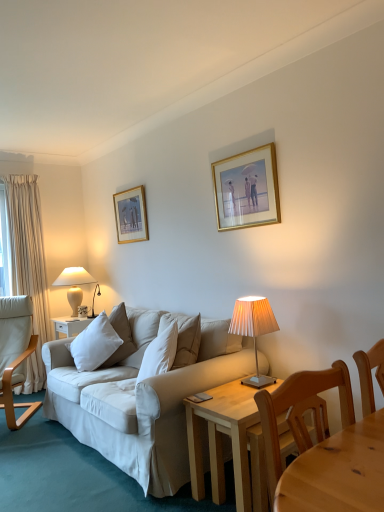
At what (x,y) coordinates should I click in order to perform the action: click on white ceramic lamp at left, the 2th lamp in the front-to-back sequence. Please return your answer as a coordinate pair (x, y). Looking at the image, I should click on tap(74, 285).

Where is `light wood table at lower right`? The height and width of the screenshot is (512, 384). light wood table at lower right is located at coordinates (221, 440).

Identify the location of white soft pillow at left. (95, 344).

The image size is (384, 512). Describe the element at coordinates (131, 215) in the screenshot. I see `gold-framed picture at upper center, placed as the 2th picture frame when sorted from front to back` at that location.

The width and height of the screenshot is (384, 512). Describe the element at coordinates (141, 402) in the screenshot. I see `white fabric couch at center` at that location.

Where is `white ceramic lamp at left, which ranks as the 1th lamp in left-to-right order`? The image size is (384, 512). white ceramic lamp at left, which ranks as the 1th lamp in left-to-right order is located at coordinates (74, 285).

From a real-world perspective, is light brown wooden chair at lower right, arranged as the second chair when viewed from the back, physically located above or below white fabric couch at center?

Clearly, from a real-world perspective, light brown wooden chair at lower right, arranged as the second chair when viewed from the back, is above white fabric couch at center.

Which of these two, light brown wooden chair at lower right, placed as the second chair when sorted from left to right, or white fabric couch at center, stands taller?

light brown wooden chair at lower right, placed as the second chair when sorted from left to right.

Is light brown wooden chair at lower right, arranged as the second chair when viewed from the back, positioned with its back to white fabric couch at center?

Yes, white fabric couch at center is at the back of light brown wooden chair at lower right, arranged as the second chair when viewed from the back.

From the picture: Considering the sizes of objects light brown wooden chair at lower right, arranged as the second chair when viewed from the back, and white fabric couch at center in the image provided, who is smaller, light brown wooden chair at lower right, arranged as the second chair when viewed from the back, or white fabric couch at center?

light brown wooden chair at lower right, arranged as the second chair when viewed from the back.

At what (x,y) coordinates should I click in order to perform the action: click on studio couch below the white soft pillow at left (from a real-world perspective). Please return your answer as a coordinate pair (x, y). This screenshot has height=512, width=384. Looking at the image, I should click on (141, 402).

Could you tell me if white soft pillow at left is turned towards white fabric couch at center?

No.

Can you confirm if white soft pillow at left is thinner than white fabric couch at center?

Indeed, white soft pillow at left has a lesser width compared to white fabric couch at center.

Which of these two, white soft pillow at left or white fabric couch at center, stands taller?

white soft pillow at left.

Can you confirm if light brown wood chair at left, which is the first chair in left-to-right order, is taller than gold-framed picture at upper center, which is counted as the first picture frame, starting from the left?

Indeed, light brown wood chair at left, which is the first chair in left-to-right order, has a greater height compared to gold-framed picture at upper center, which is counted as the first picture frame, starting from the left.

Is light brown wood chair at left, arranged as the 2th chair when viewed from the right, turned away from gold-framed picture at upper center, arranged as the 2th picture frame when viewed from the right?

No.

Does light brown wood chair at left, arranged as the 2th chair when viewed from the right, touch gold-framed picture at upper center, arranged as the 2th picture frame when viewed from the right?

No, light brown wood chair at left, arranged as the 2th chair when viewed from the right, is not in contact with gold-framed picture at upper center, arranged as the 2th picture frame when viewed from the right.

Which is farther from the camera, (1, 404) or (121, 211)?

Point (121, 211)

Is gold-framed picture at upper center, placed as the 2th picture frame when sorted from front to back, next to white soft pillow at left?

gold-framed picture at upper center, placed as the 2th picture frame when sorted from front to back, and white soft pillow at left are clearly separated.

Is gold-framed picture at upper center, arranged as the 2th picture frame when viewed from the right, looking in the opposite direction of white soft pillow at left?

No, gold-framed picture at upper center, arranged as the 2th picture frame when viewed from the right,'s orientation is not away from white soft pillow at left.

Does gold-framed picture at upper center, placed as the 2th picture frame when sorted from front to back, have a greater height compared to white soft pillow at left?

Yes.

Which is closer to the camera, (264, 298) or (217, 198)?

Clearly, point (264, 298) is closer to the camera than point (217, 198).

From the image's perspective, which object appears higher, pleated beige lampshade at center, which is the first lamp from right to left, or gold metallic picture frame at upper center, acting as the first picture frame starting from the front?

From the image's view, gold metallic picture frame at upper center, acting as the first picture frame starting from the front, is above.

From a real-world perspective, is pleated beige lampshade at center, which is the first lamp from right to left, over gold metallic picture frame at upper center, which is the first picture frame from right to left?

No, from a real-world perspective, pleated beige lampshade at center, which is the first lamp from right to left, is not over gold metallic picture frame at upper center, which is the first picture frame from right to left

From a real-world perspective, is white fabric couch at center above or below pleated beige lampshade at center, the 1th lamp positioned from the front?

Clearly, from a real-world perspective, white fabric couch at center is below pleated beige lampshade at center, the 1th lamp positioned from the front.

Who is shorter, white fabric couch at center or pleated beige lampshade at center, the 1th lamp positioned from the front?

With less height is white fabric couch at center.

Is white fabric couch at center inside or outside of pleated beige lampshade at center, positioned as the second lamp in left-to-right order?

white fabric couch at center is outside pleated beige lampshade at center, positioned as the second lamp in left-to-right order.

Measure the distance between white ceramic lamp at left, which ranks as the 1th lamp in left-to-right order, and white soft pillow at left.

white ceramic lamp at left, which ranks as the 1th lamp in left-to-right order, and white soft pillow at left are 3.47 feet apart from each other.

From a real-world perspective, is white ceramic lamp at left, which ranks as the 1th lamp in left-to-right order, on top of white soft pillow at left?

Yes.

Between white ceramic lamp at left, the second lamp in the right-to-left sequence, and white soft pillow at left, which one appears on the right side from the viewer's perspective?

Positioned to the right is white soft pillow at left.

Which is farther from the camera, (81, 281) or (72, 355)?

The point (81, 281) is more distant.

Locate an element on the screen. studio couch on the left of the light brown wooden chair at lower right, the 1th chair from the front is located at coordinates (141, 402).

Where is `studio couch below the white soft pillow at left (from a real-world perspective)`? The height and width of the screenshot is (512, 384). studio couch below the white soft pillow at left (from a real-world perspective) is located at coordinates (141, 402).

Looking at the image, which one is located closer to light brown wooden chair at lower right, arranged as the second chair when viewed from the back, light wood table at lower right or gold metallic picture frame at upper center, acting as the first picture frame starting from the front?

light wood table at lower right.

From the image, which object appears to be farther from light brown wood chair at left, which is the first chair in left-to-right order, gold metallic picture frame at upper center, acting as the second picture frame starting from the left, or gold-framed picture at upper center, which is counted as the first picture frame, starting from the left?

gold metallic picture frame at upper center, acting as the second picture frame starting from the left, is positioned further to the anchor light brown wood chair at left, which is the first chair in left-to-right order.

Based on the photo, which object lies further to the anchor point white soft pillow at left, light brown wood chair at left, acting as the 1th chair starting from the back, or gold metallic picture frame at upper center, which is the first picture frame from right to left?

gold metallic picture frame at upper center, which is the first picture frame from right to left, is further to white soft pillow at left.

Which object lies further to the anchor point gold metallic picture frame at upper center, the second picture frame from the back, white soft pillow at left or white fabric couch at center?

white soft pillow at left lies further to gold metallic picture frame at upper center, the second picture frame from the back, than the other object.

When comparing their distances from white fabric couch at center, does gold-framed picture at upper center, which is counted as the first picture frame, starting from the left, or gold metallic picture frame at upper center, which is the first picture frame from right to left, seem further?

Based on the image, gold-framed picture at upper center, which is counted as the first picture frame, starting from the left, appears to be further to white fabric couch at center.

Looking at the image, which one is located further to gold-framed picture at upper center, arranged as the 2th picture frame when viewed from the right, white fabric couch at center or gold metallic picture frame at upper center, acting as the second picture frame starting from the left?

Based on the image, white fabric couch at center appears to be further to gold-framed picture at upper center, arranged as the 2th picture frame when viewed from the right.

Estimate the real-world distances between objects in this image. Which object is closer to gold metallic picture frame at upper center, which is the first picture frame from right to left, light wood table at lower right or white ceramic lamp at left, the 2th lamp in the front-to-back sequence?

light wood table at lower right lies closer to gold metallic picture frame at upper center, which is the first picture frame from right to left, than the other object.

Based on their spatial positions, is light brown wooden chair at lower right, the 1th chair from the front, or gold-framed picture at upper center, which is counted as the first picture frame, starting from the left, further from white fabric couch at center?

The object further to white fabric couch at center is light brown wooden chair at lower right, the 1th chair from the front.

Identify the location of desk between white fabric couch at center and light brown wooden chair at lower right, placed as the second chair when sorted from left to right, from left to right. (221, 440).

Locate an element on the screen. pillow situated between light brown wood chair at left, placed as the 2th chair when sorted from front to back, and pleated beige lampshade at center, the 1th lamp positioned from the front, from left to right is located at coordinates (95, 344).

Where is `studio couch situated between light brown wood chair at left, arranged as the 2th chair when viewed from the right, and pleated beige lampshade at center, which is the first lamp from right to left, from left to right`? This screenshot has height=512, width=384. studio couch situated between light brown wood chair at left, arranged as the 2th chair when viewed from the right, and pleated beige lampshade at center, which is the first lamp from right to left, from left to right is located at coordinates pyautogui.click(x=141, y=402).

Locate an element on the screen. studio couch located between light brown wood chair at left, acting as the 1th chair starting from the back, and light wood table at lower right in the left-right direction is located at coordinates (141, 402).